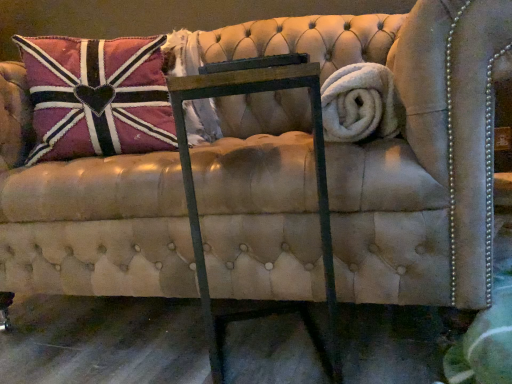
The height and width of the screenshot is (384, 512). I want to click on velvet union jack pillow at upper left, so click(97, 96).

At what (x,y) coordinates should I click in order to perform the action: click on white fluffy bath towel at right. Please return your answer as a coordinate pair (x, y). Image resolution: width=512 pixels, height=384 pixels. Looking at the image, I should click on click(x=359, y=103).

Is velvet union jack pillow at upper left wider or thinner than white fluffy bath towel at right?

Considering their sizes, velvet union jack pillow at upper left looks broader than white fluffy bath towel at right.

Is white fluffy bath towel at right a part of velvet union jack pillow at upper left?

Definitely not — white fluffy bath towel at right is not inside velvet union jack pillow at upper left.

Which is more to the left, velvet union jack pillow at upper left or white fluffy bath towel at right?

velvet union jack pillow at upper left is more to the left.

Is velvet union jack pillow at upper left turned away from white fluffy bath towel at right?

No.

Does velvet union jack pillow at upper left have a greater width compared to metal frame at center?

Incorrect, the width of velvet union jack pillow at upper left does not surpass that of metal frame at center.

Relative to metal frame at center, is velvet union jack pillow at upper left in front or behind?

Clearly, velvet union jack pillow at upper left is behind metal frame at center.

Does velvet union jack pillow at upper left have a smaller size compared to metal frame at center?

No, velvet union jack pillow at upper left is not smaller than metal frame at center.

Which is behind, point (134, 64) or point (333, 351)?

The point (134, 64) is farther from the camera.

From the image's perspective, is metal frame at center under velvet union jack pillow at upper left?

Yes, from the image's perspective, metal frame at center is beneath velvet union jack pillow at upper left.

Considering the sizes of metal frame at center and velvet union jack pillow at upper left in the image, is metal frame at center bigger or smaller than velvet union jack pillow at upper left?

Considering their sizes, metal frame at center takes up less space than velvet union jack pillow at upper left.

Are metal frame at center and velvet union jack pillow at upper left making contact?

No, metal frame at center is not with velvet union jack pillow at upper left.

From a real-world perspective, is metal frame at center positioned under velvet union jack pillow at upper left based on gravity?

Yes, from a real-world perspective, metal frame at center is under velvet union jack pillow at upper left.

Considering the positions of point (197, 96) and point (394, 108), is point (197, 96) closer or farther from the camera than point (394, 108)?

Clearly, point (197, 96) is closer to the camera than point (394, 108).

From the image's perspective, is metal frame at center positioned above or below white fluffy bath towel at right?

metal frame at center is below white fluffy bath towel at right.

Is metal frame at center positioned with its back to white fluffy bath towel at right?

That's not correct — metal frame at center is not looking away from white fluffy bath towel at right.

Which of these two, white fluffy bath towel at right or metal frame at center, is bigger?

metal frame at center.

Is white fluffy bath towel at right thinner than metal frame at center?

Indeed, white fluffy bath towel at right has a lesser width compared to metal frame at center.

How many degrees apart are the facing directions of white fluffy bath towel at right and metal frame at center?

The angle between the facing direction of white fluffy bath towel at right and the facing direction of metal frame at center is 71.8 degrees.

Looking at this image, is white fluffy bath towel at right looking in the opposite direction of metal frame at center?

No, metal frame at center is not at the back of white fluffy bath towel at right.

Consider the image. How many degrees apart are the facing directions of white fluffy bath towel at right and velvet union jack pillow at upper left?

There is a 120-degree angle between the facing directions of white fluffy bath towel at right and velvet union jack pillow at upper left.

From the image's perspective, is white fluffy bath towel at right below velvet union jack pillow at upper left?

Indeed, from the image's perspective, white fluffy bath towel at right is shown beneath velvet union jack pillow at upper left.

Between white fluffy bath towel at right and velvet union jack pillow at upper left, which one has smaller width?

Thinner between the two is white fluffy bath towel at right.

Could you tell me if white fluffy bath towel at right is facing velvet union jack pillow at upper left?

Yes, white fluffy bath towel at right is turned towards velvet union jack pillow at upper left.

Locate an element on the screen. pillow positioned vertically above the white fluffy bath towel at right (from a real-world perspective) is located at coordinates (97, 96).

The image size is (512, 384). I want to click on rocking chair below the velvet union jack pillow at upper left (from a real-world perspective), so click(x=317, y=190).

Looking at the image, which one is located closer to metal frame at center, velvet union jack pillow at upper left or white fluffy bath towel at right?

The object closer to metal frame at center is white fluffy bath towel at right.

Looking at the image, which one is located further to velvet union jack pillow at upper left, metal frame at center or white fluffy bath towel at right?

white fluffy bath towel at right lies further to velvet union jack pillow at upper left than the other object.

Looking at the image, which one is located further to white fluffy bath towel at right, velvet union jack pillow at upper left or metal frame at center?

velvet union jack pillow at upper left is positioned further to the anchor white fluffy bath towel at right.

Based on their spatial positions, is white fluffy bath towel at right or metal frame at center further from velvet union jack pillow at upper left?

The object further to velvet union jack pillow at upper left is white fluffy bath towel at right.

Looking at this image, from the image, which object appears to be nearer to metal frame at center, white fluffy bath towel at right or velvet union jack pillow at upper left?

white fluffy bath towel at right is closer to metal frame at center.

From the image, which object appears to be nearer to white fluffy bath towel at right, metal frame at center or velvet union jack pillow at upper left?

The object closer to white fluffy bath towel at right is metal frame at center.

Find the location of `rocking chair situated between velvet union jack pillow at upper left and white fluffy bath towel at right from left to right`. rocking chair situated between velvet union jack pillow at upper left and white fluffy bath towel at right from left to right is located at coordinates (317, 190).